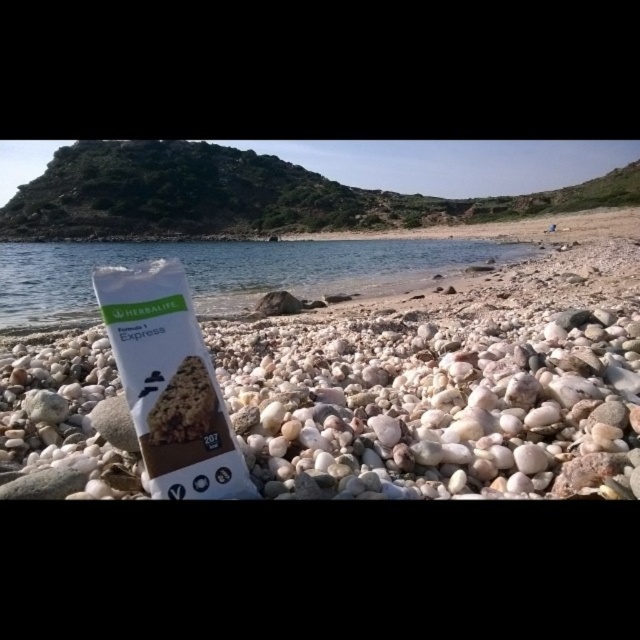
Question: Is white pebbled beach at center smaller than clear water at center?

Choices:
 (A) yes
 (B) no

Answer: (A)

Question: Does clear water at center appear under white cardboard package at center?

Choices:
 (A) no
 (B) yes

Answer: (A)

Question: Is white pebbled beach at center positioned before clear water at center?

Choices:
 (A) no
 (B) yes

Answer: (B)

Question: Which point is closer to the camera?

Choices:
 (A) clear water at center
 (B) white pebbled beach at center
 (C) white cardboard package at center

Answer: (C)

Question: Which object appears closest to the camera in this image?

Choices:
 (A) clear water at center
 (B) white pebbled beach at center
 (C) white cardboard package at center

Answer: (C)

Question: Which object is the closest to the white pebbled beach at center?

Choices:
 (A) clear water at center
 (B) white cardboard package at center

Answer: (B)